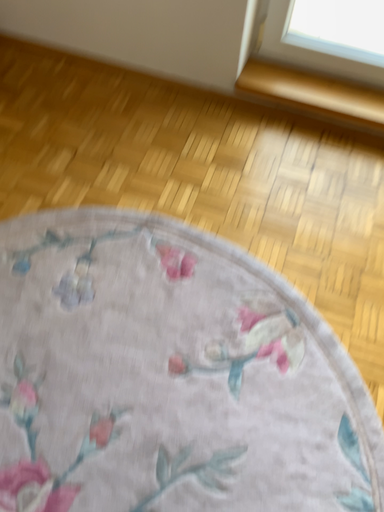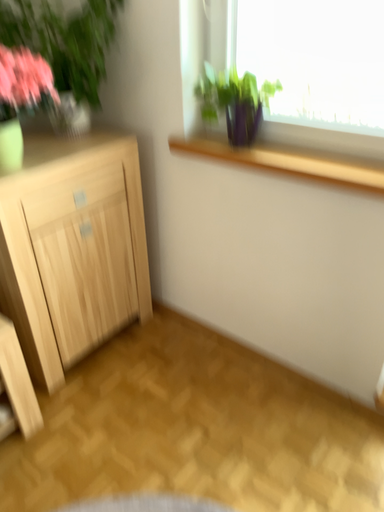
Question: How did the camera likely rotate when shooting the video?

Choices:
 (A) rotated downward
 (B) rotated upward

Answer: (B)